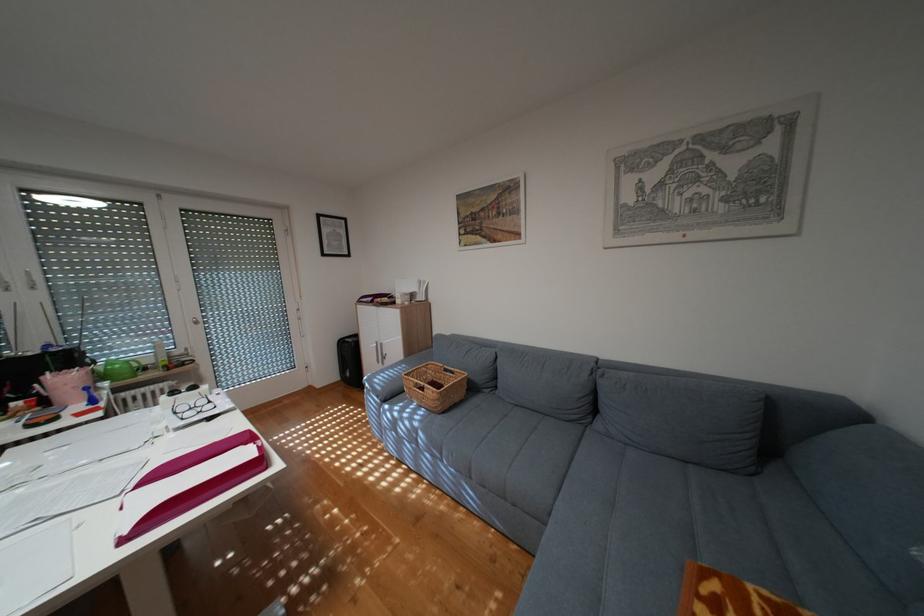
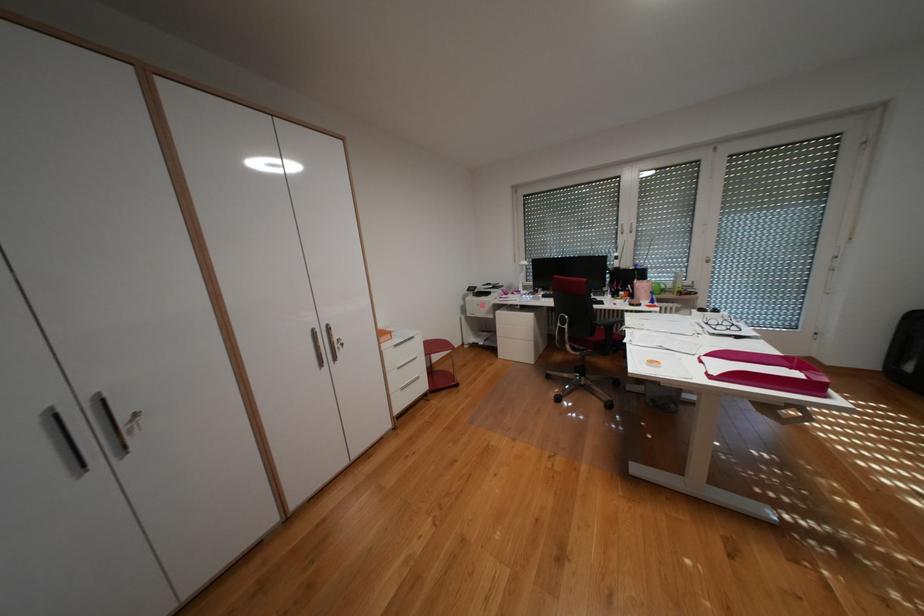
How did the camera likely rotate?

The rotation direction of the camera is left-down.